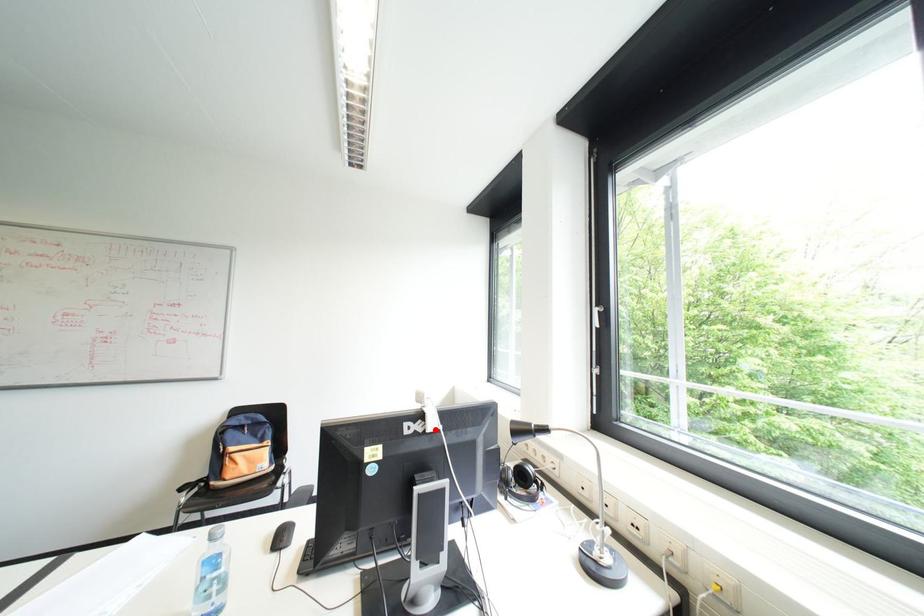
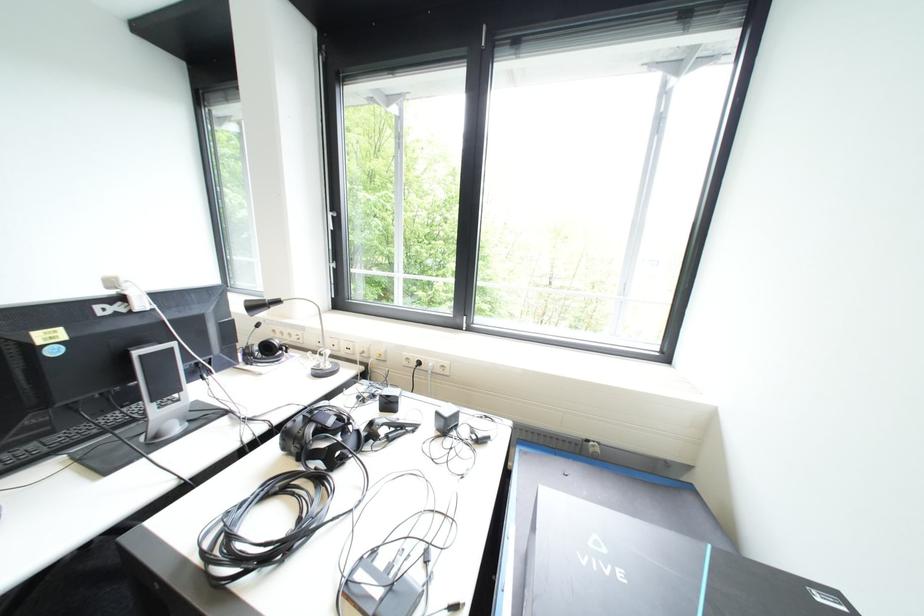
In the second image, find the point that corresponds to the highlighted location in the first image.

(148, 309)